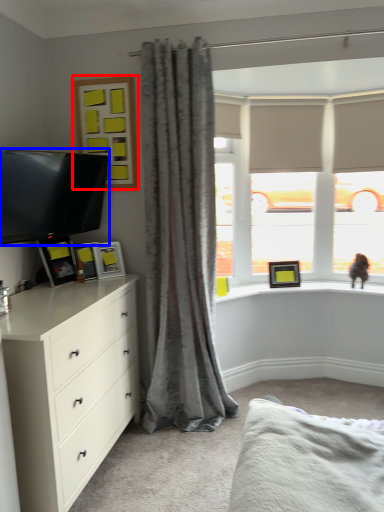
Question: Which object appears closest to the camera in this image, picture frame (highlighted by a red box) or television (highlighted by a blue box)?

Choices:
 (A) picture frame
 (B) television

Answer: (B)